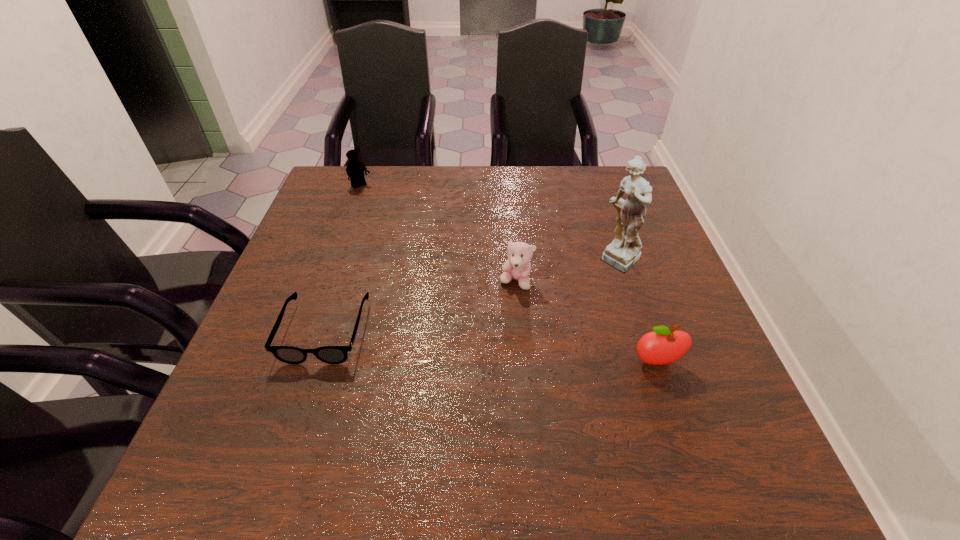
Where is `free region located 0.170m on the front-facing side of the Lego`? The height and width of the screenshot is (540, 960). free region located 0.170m on the front-facing side of the Lego is located at coordinates (392, 220).

Find the location of `free location located on the front-facing side of the Lego`. free location located on the front-facing side of the Lego is located at coordinates (436, 267).

This screenshot has height=540, width=960. Identify the location of vacant space located 0.260m on the front-facing side of the Lego. (408, 237).

Locate an element on the screen. This screenshot has height=540, width=960. free space located at the face of the teddy bear is located at coordinates (432, 355).

This screenshot has width=960, height=540. I want to click on free spot located at the face of the teddy bear, so click(401, 382).

The image size is (960, 540). What are the coordinates of `free space located at the face of the teddy bear` in the screenshot? It's located at (397, 386).

You are a GUI agent. You are given a task and a screenshot of the screen. Output one action in this format:
    pyautogui.click(x=<x>, y=<y>)
    Task: Click on the object situated at the far edge
    The height and width of the screenshot is (540, 960).
    Given the screenshot: What is the action you would take?
    pyautogui.click(x=355, y=169)

This screenshot has width=960, height=540. Find the location of `spectacles that is at the left edge`. spectacles that is at the left edge is located at coordinates (288, 354).

I want to click on Lego present at the left edge, so click(355, 169).

Find the location of a particular element. apple present at the right edge is located at coordinates (662, 346).